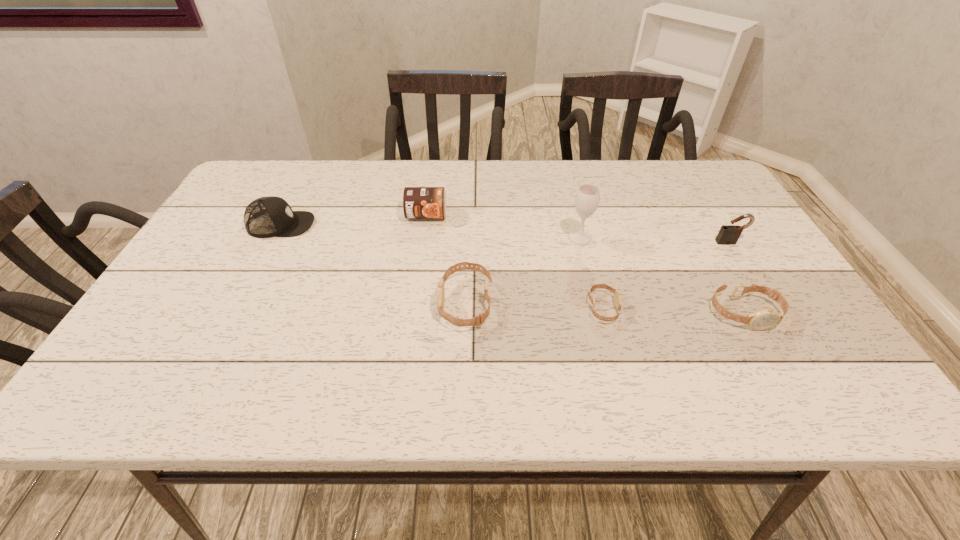
In order to click on object that is at the near right corner in this screenshot , I will do `click(764, 319)`.

Locate an element on the screen. vacant space at the far edge of the desktop is located at coordinates (480, 179).

Where is `free space at the near edge of the desktop`? free space at the near edge of the desktop is located at coordinates (269, 357).

In the image, there is a desktop. What are the coordinates of `blank space at the left edge` in the screenshot? It's located at (197, 305).

The image size is (960, 540). In the image, there is a desktop. What are the coordinates of `vacant space at the right edge` in the screenshot? It's located at (791, 286).

The height and width of the screenshot is (540, 960). In order to click on vacant space at the far left corner of the desktop in this screenshot , I will do `click(276, 185)`.

In the image, there is a desktop. Where is `vacant space at the far right corner`? This screenshot has width=960, height=540. vacant space at the far right corner is located at coordinates (660, 169).

Where is `vacant area that lies between the second shortest watch and the leftmost watch`? Image resolution: width=960 pixels, height=540 pixels. vacant area that lies between the second shortest watch and the leftmost watch is located at coordinates (605, 308).

You are a GUI agent. You are given a task and a screenshot of the screen. Output one action in this format:
    pyautogui.click(x=<x>, y=<y>)
    Task: Click on the vacant space that's between the wineglass and the leftmost object
    The height and width of the screenshot is (540, 960).
    Given the screenshot: What is the action you would take?
    pyautogui.click(x=430, y=232)

Identify the location of free space between the can and the second shortest watch. This screenshot has height=540, width=960. (586, 264).